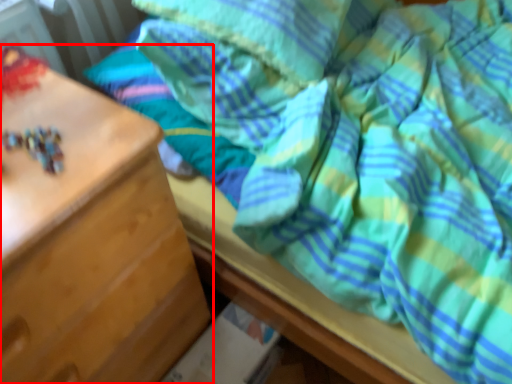
Question: From the image's perspective, what is the correct spatial positioning of chest of drawers (annotated by the red box) in reference to pillow?

Choices:
 (A) below
 (B) above

Answer: (A)